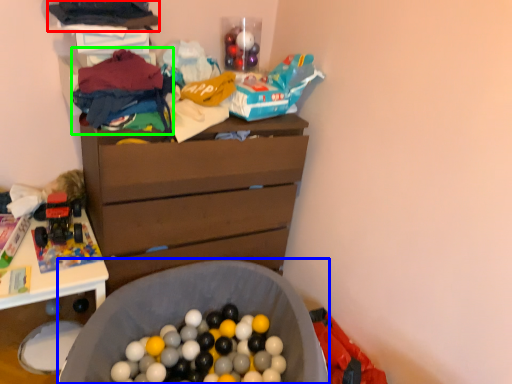
Question: Considering the real-world distances, which object is closest to clothing (highlighted by a red box)? laundry basket (highlighted by a blue box) or clothing (highlighted by a green box).

Choices:
 (A) laundry basket
 (B) clothing

Answer: (B)